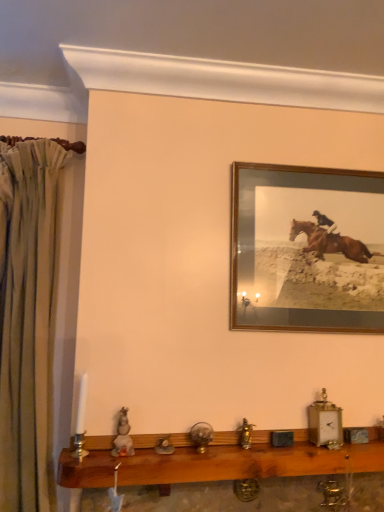
I want to click on wooden shelf at lower center, so click(x=214, y=460).

Is wooden shelf at lower center not inside wooden frame at upper right?

That's correct, wooden shelf at lower center is outside of wooden frame at upper right.

Could you tell me if wooden shelf at lower center is turned towards wooden frame at upper right?

No, wooden shelf at lower center is not facing towards wooden frame at upper right.

From a real-world perspective, does wooden shelf at lower center stand above wooden frame at upper right?

No, from a real-world perspective, wooden shelf at lower center is not above wooden frame at upper right.

Is wooden shelf at lower center facing away from beige fabric curtain at left?

No, wooden shelf at lower center's orientation is not away from beige fabric curtain at left.

Can you confirm if wooden shelf at lower center is bigger than beige fabric curtain at left?

Actually, wooden shelf at lower center might be smaller than beige fabric curtain at left.

Is point (42, 356) more distant than point (159, 434)?

That is True.

Is beige fabric curtain at left in front of or behind wooden shelf at lower center in the image?

beige fabric curtain at left is positioned farther from the viewer than wooden shelf at lower center.

Which of these two, beige fabric curtain at left or wooden shelf at lower center, stands shorter?

With less height is wooden shelf at lower center.

In the image, there is a beige fabric curtain at left. Where is `table below it (from the image's perspective)`? Image resolution: width=384 pixels, height=512 pixels. table below it (from the image's perspective) is located at coordinates [x=214, y=460].

At what (x,y) coordinates should I click in order to perform the action: click on picture frame behind the wooden shelf at lower center. Please return your answer as a coordinate pair (x, y). The image size is (384, 512). Looking at the image, I should click on (307, 249).

Which is more to the right, wooden frame at upper right or wooden shelf at lower center?

wooden frame at upper right.

Is wooden frame at upper right facing away from wooden shelf at lower center?

No, wooden frame at upper right is not facing away from wooden shelf at lower center.

Can you confirm if wooden frame at upper right is wider than wooden shelf at lower center?

No, wooden frame at upper right is not wider than wooden shelf at lower center.

Can you confirm if wooden frame at upper right is shorter than beige fabric curtain at left?

Yes, wooden frame at upper right is shorter than beige fabric curtain at left.

From a real-world perspective, does wooden frame at upper right stand above beige fabric curtain at left?

Yes, from a real-world perspective, wooden frame at upper right is on top of beige fabric curtain at left.

In the scene shown: Considering the sizes of wooden frame at upper right and beige fabric curtain at left in the image, is wooden frame at upper right bigger or smaller than beige fabric curtain at left?

Considering their sizes, wooden frame at upper right takes up less space than beige fabric curtain at left.

At what (x,y) coordinates should I click in order to perform the action: click on picture frame on the right of the beige fabric curtain at left. Please return your answer as a coordinate pair (x, y). Looking at the image, I should click on (307, 249).

Would you say beige fabric curtain at left is to the left or to the right of wooden frame at upper right in the picture?

Based on their positions, beige fabric curtain at left is located to the left of wooden frame at upper right.

Is beige fabric curtain at left thinner than wooden frame at upper right?

Incorrect, the width of beige fabric curtain at left is not less than that of wooden frame at upper right.

How much distance is there between beige fabric curtain at left and wooden frame at upper right?

The distance of beige fabric curtain at left from wooden frame at upper right is 31.27 inches.

Is beige fabric curtain at left positioned before wooden frame at upper right?

Yes, it is in front of wooden frame at upper right.

I want to click on table that appears in front of the wooden frame at upper right, so click(x=214, y=460).

This screenshot has height=512, width=384. I want to click on table below the beige fabric curtain at left (from the image's perspective), so [214, 460].

Which object lies further to the anchor point wooden shelf at lower center, beige fabric curtain at left or wooden frame at upper right?

The object further to wooden shelf at lower center is wooden frame at upper right.

Considering their positions, is wooden frame at upper right positioned further to wooden shelf at lower center than beige fabric curtain at left?

wooden frame at upper right.

Based on their spatial positions, is wooden shelf at lower center or beige fabric curtain at left further from wooden frame at upper right?

Among the two, beige fabric curtain at left is located further to wooden frame at upper right.

From the image, which object appears to be nearer to wooden frame at upper right, beige fabric curtain at left or wooden shelf at lower center?

Based on the image, wooden shelf at lower center appears to be nearer to wooden frame at upper right.

Looking at the image, which one is located further to beige fabric curtain at left, wooden frame at upper right or wooden shelf at lower center?

Among the two, wooden frame at upper right is located further to beige fabric curtain at left.

Estimate the real-world distances between objects in this image. Which object is further from beige fabric curtain at left, wooden shelf at lower center or wooden frame at upper right?

wooden frame at upper right lies further to beige fabric curtain at left than the other object.

This screenshot has width=384, height=512. I want to click on table between beige fabric curtain at left and wooden frame at upper right from left to right, so click(214, 460).